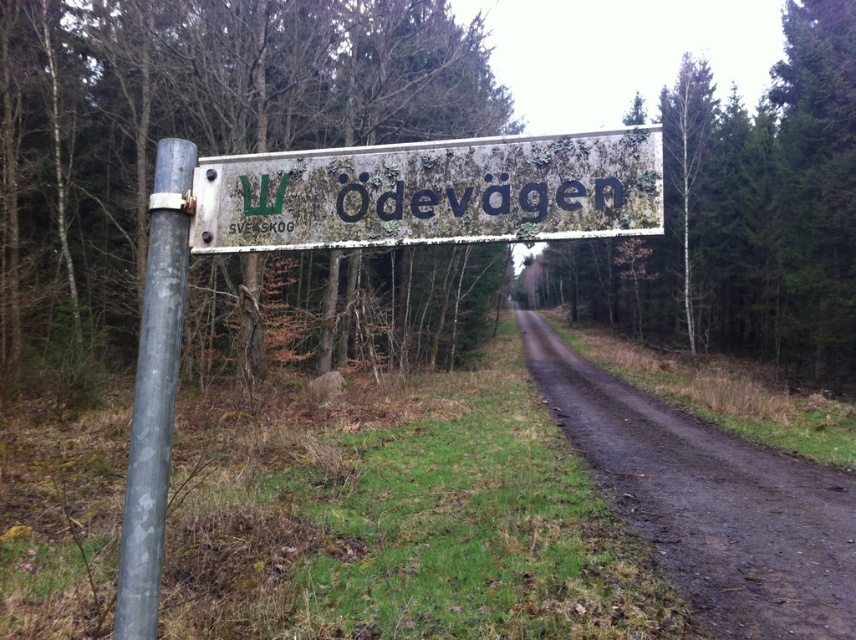
Is green mossy tree at center bigger than rusty metal sign at center?

Indeed, green mossy tree at center has a larger size compared to rusty metal sign at center.

Is green mossy tree at center taller than rusty metal sign at center?

Yes, green mossy tree at center is taller than rusty metal sign at center.

Identify the location of green mossy tree at center. The image size is (856, 640). (x=749, y=216).

This screenshot has height=640, width=856. Find the location of `green mossy tree at center`. green mossy tree at center is located at coordinates (749, 216).

Does brown dirt track at center have a greater width compared to rusty metal sign at center?

Indeed, brown dirt track at center has a greater width compared to rusty metal sign at center.

Can you confirm if brown dirt track at center is smaller than rusty metal sign at center?

Incorrect, brown dirt track at center is not smaller in size than rusty metal sign at center.

In order to click on brown dirt track at center in this screenshot , I will do `click(710, 500)`.

From the picture: Between rusty metal sign at center and smooth metallic pole at left, which one appears on the right side from the viewer's perspective?

rusty metal sign at center is more to the right.

Does point (220, 252) come closer to viewer compared to point (119, 634)?

No.

Is point (635, 234) closer to viewer compared to point (146, 257)?

Yes.

Image resolution: width=856 pixels, height=640 pixels. In order to click on rusty metal sign at center in this screenshot , I will do `click(432, 193)`.